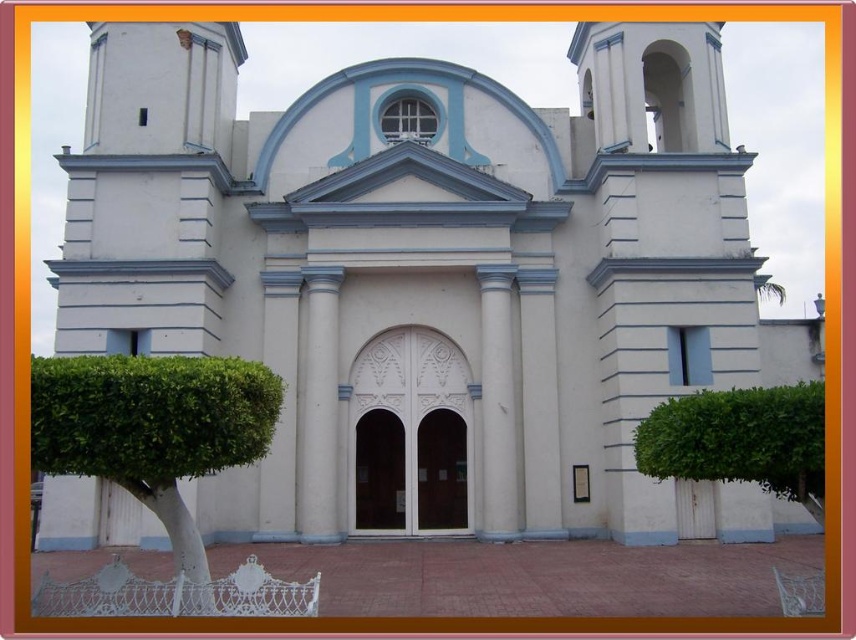
Between green leafy bush at lower left and green leafy bush at right, which one has more height?

Standing taller between the two is green leafy bush at lower left.

Is green leafy bush at lower left bigger than green leafy bush at right?

Correct, green leafy bush at lower left is larger in size than green leafy bush at right.

Which is in front, point (82, 401) or point (774, 468)?

Point (82, 401) is in front.

Identify the location of green leafy bush at lower left. (150, 456).